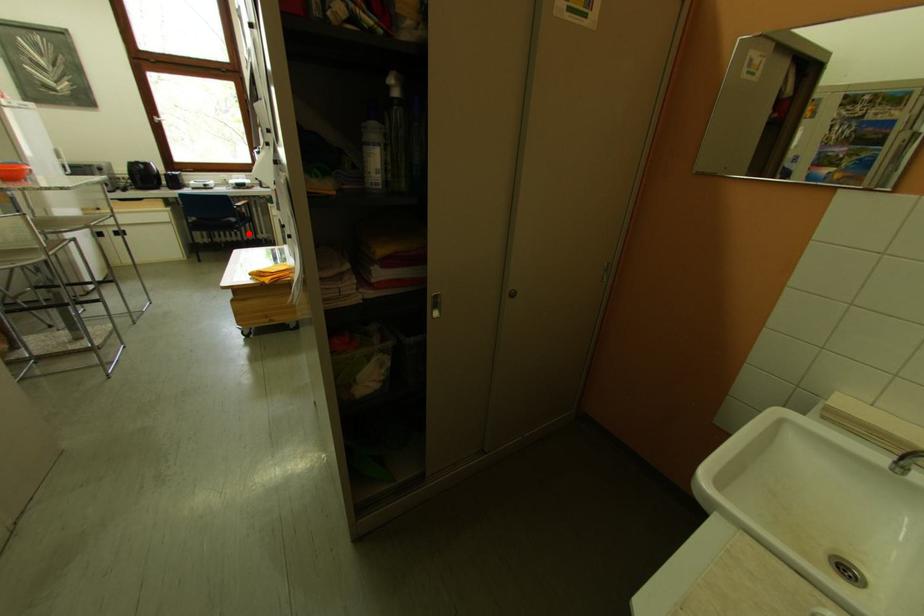
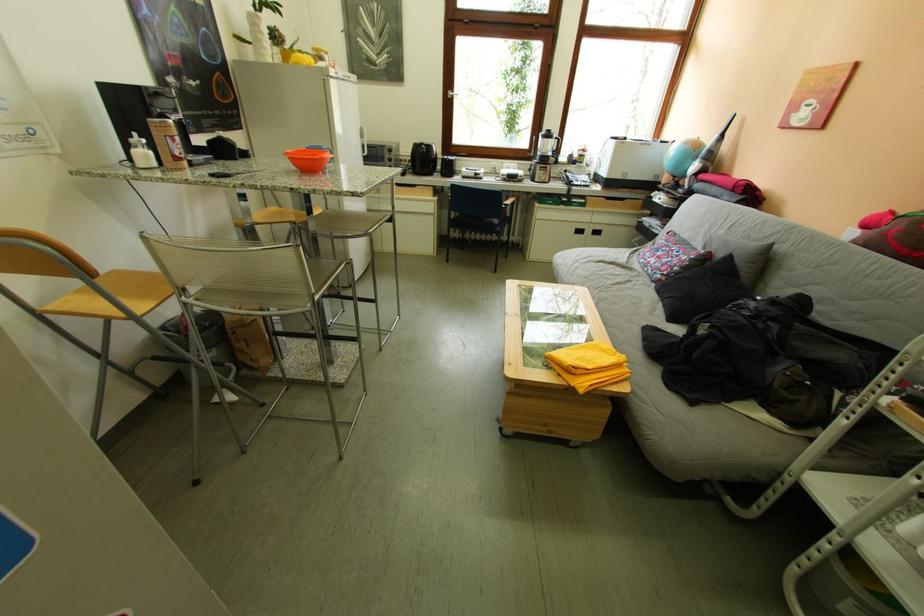
Where in the second image is the point corresponding to the highlighted location from the first image?

(507, 238)